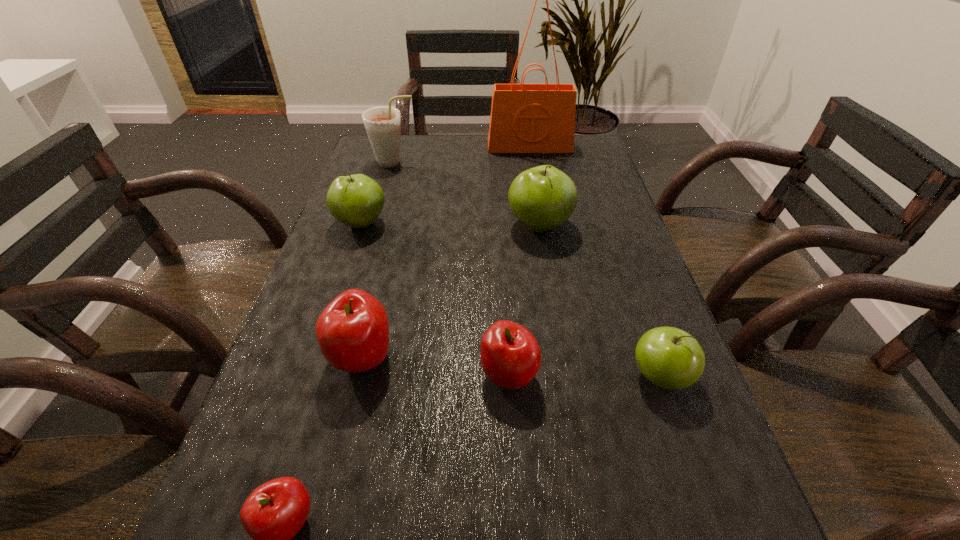
Find the location of a particular element. tote bag is located at coordinates (525, 118).

I want to click on the tallest object, so click(x=525, y=118).

This screenshot has height=540, width=960. What are the coordinates of `the second farthest object` in the screenshot? It's located at (382, 124).

Identify the location of the biggest green apple. The width and height of the screenshot is (960, 540). (542, 198).

Image resolution: width=960 pixels, height=540 pixels. Find the location of `the second green apple from left to right`. the second green apple from left to right is located at coordinates (542, 198).

Locate an element on the screen. This screenshot has height=540, width=960. the second biggest green apple is located at coordinates (357, 200).

The image size is (960, 540). In order to click on the biggest red apple in this screenshot , I will do `click(352, 331)`.

I want to click on the rightmost apple, so click(668, 357).

Find the location of a particular element. the nearest green apple is located at coordinates (668, 357).

Where is `the rightmost red apple`? Image resolution: width=960 pixels, height=540 pixels. the rightmost red apple is located at coordinates (510, 355).